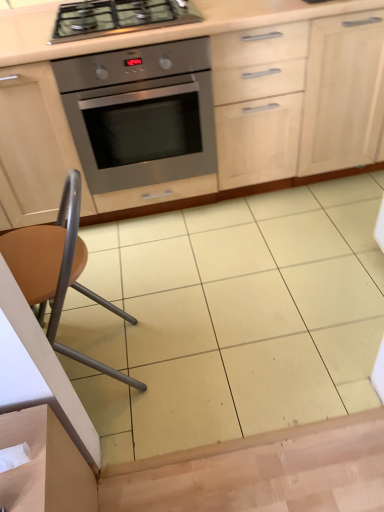
What do you see at coordinates (119, 17) in the screenshot? I see `stainless steel gas stove at upper center` at bounding box center [119, 17].

Describe the element at coordinates (141, 114) in the screenshot. I see `stainless steel oven at center` at that location.

What is the approximate width of stainless steel oven at center?

The width of stainless steel oven at center is 24.63 inches.

The width and height of the screenshot is (384, 512). I want to click on matte wood cabinetry at center, so click(214, 101).

Find the location of a particular element. This screenshot has width=384, height=512. brown matte chair at lower left is located at coordinates (57, 271).

Is the depth of brown matte chair at lower left greater than that of stainless steel oven at center?

No, it is not.

Which of these two, brown matte chair at lower left or stainless steel oven at center, stands shorter?

stainless steel oven at center is shorter.

What's the angular difference between brown matte chair at lower left and stainless steel oven at center's facing directions?

The angular difference between brown matte chair at lower left and stainless steel oven at center is 90.6 degrees.

Could you tell me if brown matte chair at lower left is facing stainless steel oven at center?

No, brown matte chair at lower left is not oriented towards stainless steel oven at center.

Looking at this image, which object is thinner, brown matte chair at lower left or stainless steel gas stove at upper center?

brown matte chair at lower left is thinner.

Does brown matte chair at lower left have a smaller size compared to stainless steel gas stove at upper center?

No.

Is the depth of brown matte chair at lower left less than that of stainless steel gas stove at upper center?

Yes, it is.

From the image's perspective, is brown matte chair at lower left above or below stainless steel gas stove at upper center?

Clearly, from the image's perspective, brown matte chair at lower left is below stainless steel gas stove at upper center.

Are stainless steel oven at center and brown matte chair at lower left beside each other?

No, stainless steel oven at center is not making contact with brown matte chair at lower left.

Based on the photo, between stainless steel oven at center and brown matte chair at lower left, which one has larger width?

stainless steel oven at center is wider.

Is stainless steel oven at center situated inside brown matte chair at lower left or outside?

stainless steel oven at center is not inside brown matte chair at lower left, it's outside.

Is stainless steel oven at center at the left side of brown matte chair at lower left?

Incorrect, stainless steel oven at center is not on the left side of brown matte chair at lower left.

Does stainless steel gas stove at upper center have a smaller size compared to brown matte chair at lower left?

Yes, stainless steel gas stove at upper center is smaller than brown matte chair at lower left.

What's the angular difference between stainless steel gas stove at upper center and brown matte chair at lower left's facing directions?

92 degrees.

Can you confirm if stainless steel gas stove at upper center is shorter than brown matte chair at lower left?

Yes, stainless steel gas stove at upper center is shorter than brown matte chair at lower left.

Considering the relative sizes of stainless steel gas stove at upper center and brown matte chair at lower left in the image provided, is stainless steel gas stove at upper center wider than brown matte chair at lower left?

Yes, stainless steel gas stove at upper center is wider than brown matte chair at lower left.

From a real-world perspective, is stainless steel gas stove at upper center positioned above or below stainless steel oven at center?

stainless steel gas stove at upper center is situated higher than stainless steel oven at center in the real world.

At what (x,y) coordinates should I click in order to perform the action: click on gas stove above the stainless steel oven at center (from a real-world perspective). Please return your answer as a coordinate pair (x, y). The width and height of the screenshot is (384, 512). Looking at the image, I should click on (119, 17).

From the image's perspective, is stainless steel gas stove at upper center located above or below stainless steel oven at center?

Based on their image positions, stainless steel gas stove at upper center is located above stainless steel oven at center.

Can we say stainless steel gas stove at upper center lies outside stainless steel oven at center?

That's correct, stainless steel gas stove at upper center is outside of stainless steel oven at center.

Does stainless steel gas stove at upper center have a greater width compared to matte wood cabinetry at center?

No.

Is stainless steel gas stove at upper center to the right of matte wood cabinetry at center from the viewer's perspective?

No, stainless steel gas stove at upper center is not to the right of matte wood cabinetry at center.

Can you tell me how much stainless steel gas stove at upper center and matte wood cabinetry at center differ in facing direction?

0.891 degrees.

Is stainless steel oven at center far from stainless steel gas stove at upper center?

That's not correct — stainless steel oven at center is a little close to stainless steel gas stove at upper center.

From a real-world perspective, is stainless steel oven at center physically located above or below stainless steel gas stove at upper center?

Clearly, from a real-world perspective, stainless steel oven at center is below stainless steel gas stove at upper center.

Is stainless steel oven at center taller than stainless steel gas stove at upper center?

Yes, stainless steel oven at center is taller than stainless steel gas stove at upper center.

Is stainless steel oven at center in front of or behind stainless steel gas stove at upper center in the image?

Visually, stainless steel oven at center is located behind stainless steel gas stove at upper center.

Locate an element on the screen. This screenshot has width=384, height=512. oven above the brown matte chair at lower left (from a real-world perspective) is located at coordinates (141, 114).

Find the location of `gas stove behind the brown matte chair at lower left`. gas stove behind the brown matte chair at lower left is located at coordinates (119, 17).

Estimate the real-world distances between objects in this image. Which object is further from stainless steel oven at center, matte wood cabinetry at center or stainless steel gas stove at upper center?

stainless steel gas stove at upper center lies further to stainless steel oven at center than the other object.

From the image, which object appears to be nearer to matte wood cabinetry at center, stainless steel gas stove at upper center or stainless steel oven at center?

stainless steel oven at center lies closer to matte wood cabinetry at center than the other object.

Based on their spatial positions, is brown matte chair at lower left or stainless steel oven at center closer to matte wood cabinetry at center?

Among the two, stainless steel oven at center is located nearer to matte wood cabinetry at center.

Looking at the image, which one is located closer to matte wood cabinetry at center, brown matte chair at lower left or stainless steel gas stove at upper center?

The object closer to matte wood cabinetry at center is stainless steel gas stove at upper center.

When comparing their distances from stainless steel oven at center, does brown matte chair at lower left or matte wood cabinetry at center seem closer?

matte wood cabinetry at center lies closer to stainless steel oven at center than the other object.

From the image, which object appears to be nearer to stainless steel oven at center, stainless steel gas stove at upper center or brown matte chair at lower left?

stainless steel gas stove at upper center is positioned closer to the anchor stainless steel oven at center.

Based on their spatial positions, is matte wood cabinetry at center or brown matte chair at lower left closer to stainless steel gas stove at upper center?

The object closer to stainless steel gas stove at upper center is matte wood cabinetry at center.

Which object lies nearer to the anchor point stainless steel oven at center, matte wood cabinetry at center or brown matte chair at lower left?

matte wood cabinetry at center is positioned closer to the anchor stainless steel oven at center.

Identify the location of oven between stainless steel gas stove at upper center and brown matte chair at lower left from top to bottom. (141, 114).

In order to click on cabinetry between stainless steel gas stove at upper center and brown matte chair at lower left vertically in this screenshot , I will do `click(214, 101)`.

You are a GUI agent. You are given a task and a screenshot of the screen. Output one action in this format:
    pyautogui.click(x=<x>, y=<y>)
    Task: Click on the oven located between stainless steel gas stove at upper center and matte wood cabinetry at center in the left-right direction
    The height and width of the screenshot is (512, 384).
    Given the screenshot: What is the action you would take?
    pyautogui.click(x=141, y=114)

At what (x,y) coordinates should I click in order to perform the action: click on oven between matte wood cabinetry at center and brown matte chair at lower left vertically. Please return your answer as a coordinate pair (x, y). Image resolution: width=384 pixels, height=512 pixels. Looking at the image, I should click on (141, 114).